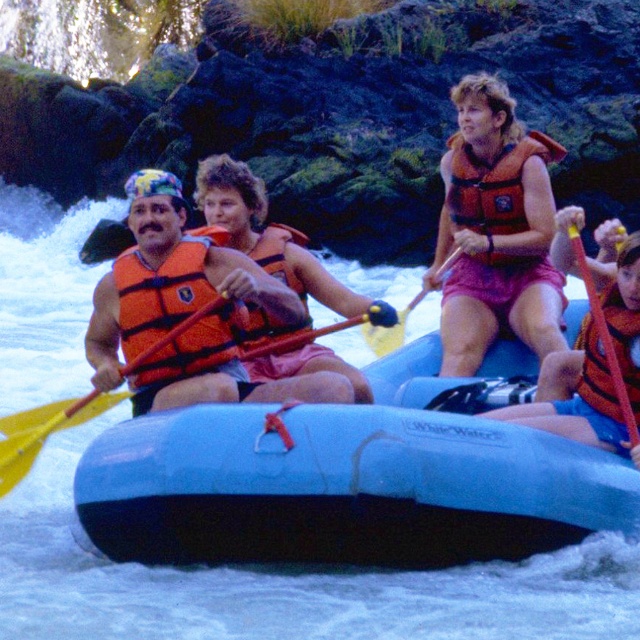
You are a safety inspector checking the raft setup. According to the image, is the orange life vest at right positioned correctly relative to the rubber paddle at right for proper safety protocols?

The orange life vest at right is below the rubber paddle at right, which means the paddle is above the life vest. This positioning aligns with proper safety protocols as the paddle should be easily accessible above the life vest for quick use during navigation.

You are a photographer trying to capture a photo of the yellow plastic paddle at left and the orange life jacket at center. Based on their sizes in the image, which object would appear larger in your photo?

The yellow plastic paddle at left is much taller than the orange life jacket at center, so it would appear larger in the photo.

You are a safety inspector checking the rafting gear. You notice two orange life vests on the blue inflatable raft labeled White Water. According to safety regulations, life vests must be worn over life jackets. Is the current arrangement of the orange life vest at upper center and orange life jacket at left compliant with the safety regulations?

The orange life vest at upper center is positioned over orange life jacket at left, so the current arrangement is compliant with the safety regulations.